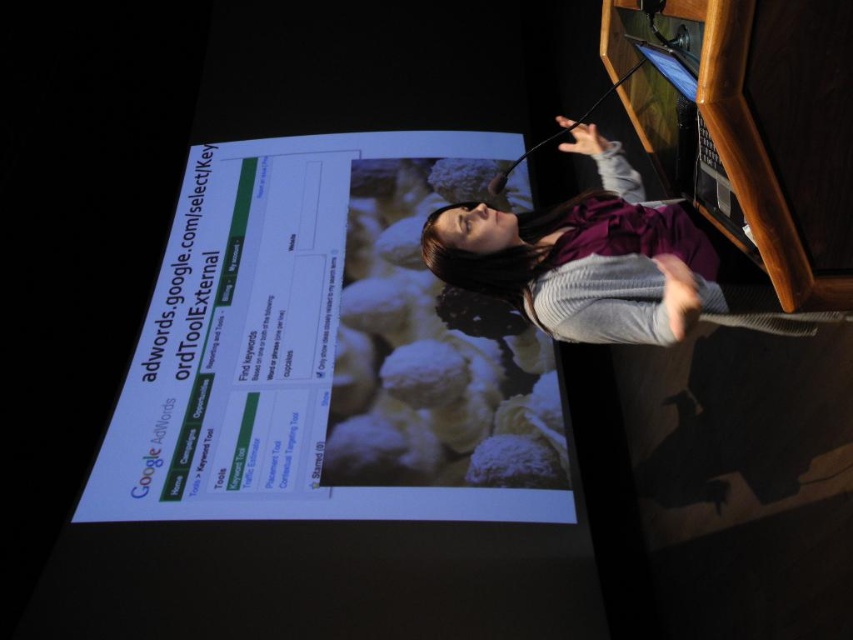
You are an attendee sitting in the front row of the presentation. You want to look at both the white glossy projector screen at center and the purple fabric dress at center. Which object will appear larger to you?

The white glossy projector screen at center will appear larger because it is closer to you than the purple fabric dress at center.

You are an attendee at this presentation and want to take a photo of the white glossy projector screen at center and the purple fabric dress at center. Which one should you focus on first to ensure both are in focus?

The white glossy projector screen at center is located below the purple fabric dress at center, so you should focus on the purple fabric dress at center first to ensure both are in focus.

You are an attendee at the presentation and notice two points on the projection screen. The first point is located at coordinates point (364, 362) and the second at point (523, 275). Which point is closer to the bottom of the screen?

Point (364, 362) is closer to the bottom of the screen because it has a lower y coordinate than point (523, 275).